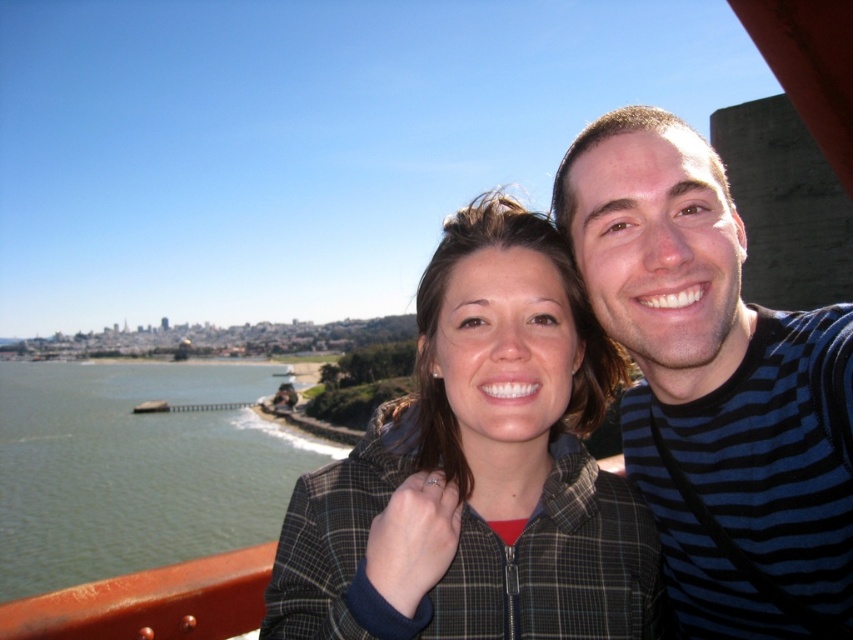
Is plaid jacket at center to the right of blue striped shirt at upper right from the viewer's perspective?

No, plaid jacket at center is not to the right of blue striped shirt at upper right.

Is plaid jacket at center to the left of blue striped shirt at upper right from the viewer's perspective?

Indeed, plaid jacket at center is positioned on the left side of blue striped shirt at upper right.

Image resolution: width=853 pixels, height=640 pixels. In order to click on plaid jacket at center in this screenshot , I will do `click(479, 468)`.

Where is `plaid jacket at center`? plaid jacket at center is located at coordinates (479, 468).

Does plaid jacket at center have a greater height compared to green water at lower left?

No, plaid jacket at center is not taller than green water at lower left.

Does plaid jacket at center have a smaller size compared to green water at lower left?

Yes.

Is point (369, 605) in front of point (160, 381)?

Yes.

Locate an element on the screen. plaid jacket at center is located at coordinates (479, 468).

Does blue striped shirt at upper right have a greater height compared to green water at lower left?

In fact, blue striped shirt at upper right may be shorter than green water at lower left.

Is point (584, 268) positioned behind point (277, 509)?

No, (584, 268) is closer to viewer.

Is point (787, 516) in front of point (271, 436)?

Yes, point (787, 516) is in front of point (271, 436).

You are a GUI agent. You are given a task and a screenshot of the screen. Output one action in this format:
    pyautogui.click(x=<x>, y=<y>)
    Task: Click on the blue striped shirt at upper right
    Image resolution: width=853 pixels, height=640 pixels.
    Given the screenshot: What is the action you would take?
    pyautogui.click(x=715, y=387)